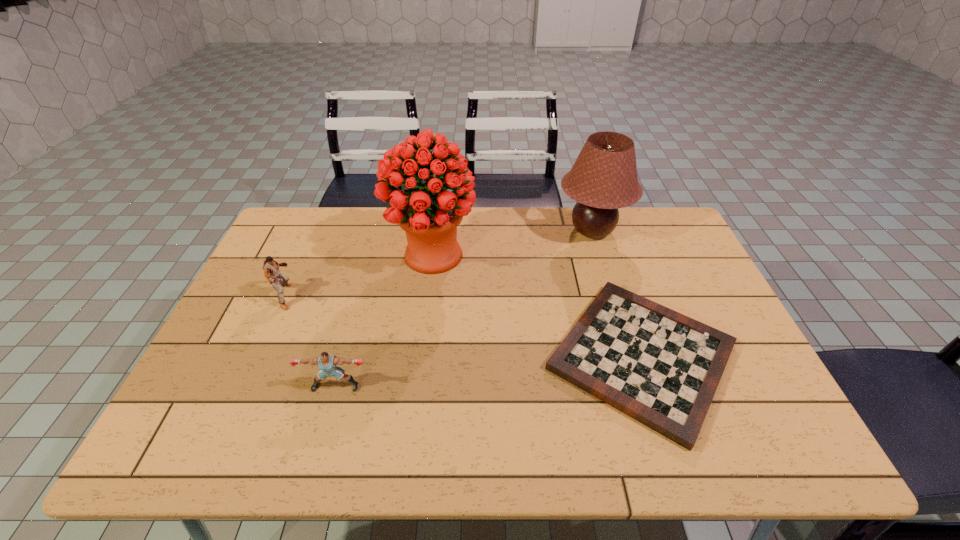
Identify the location of vacant space that is in between the bouquet and the second tallest object. (513, 243).

I want to click on free space between the leftmost object and the nearer puncher, so click(311, 341).

You are a GUI agent. You are given a task and a screenshot of the screen. Output one action in this format:
    pyautogui.click(x=<x>, y=<y>)
    Task: Click on the vacant area between the leftmost object and the fourth tallest object
    
    Given the screenshot: What is the action you would take?
    pyautogui.click(x=311, y=341)

Where is `free space between the farther puncher and the shortest object`? free space between the farther puncher and the shortest object is located at coordinates (464, 327).

The width and height of the screenshot is (960, 540). Identify the location of the third closest object to the bouquet. (604, 178).

Find the location of a particular element. The image size is (960, 540). object that is the third closest to the left puncher is located at coordinates (662, 368).

I want to click on vacant space that satisfies the following two spatial constraints: 1. on the front side of the shortest object; 2. on the right side of the bouquet, so click(420, 356).

At what (x,y) coordinates should I click in order to perform the action: click on vacant space that satisfies the following two spatial constraints: 1. on the front-facing side of the shortest object; 2. on the right side of the lampshade. Please return your answer as a coordinate pair (x, y). The image size is (960, 540). Looking at the image, I should click on (631, 356).

The height and width of the screenshot is (540, 960). Find the location of `blank space that satisfies the following two spatial constraints: 1. on the front-facing side of the lampshade; 2. on the front-facing side of the shorter puncher`. blank space that satisfies the following two spatial constraints: 1. on the front-facing side of the lampshade; 2. on the front-facing side of the shorter puncher is located at coordinates (639, 386).

You are a GUI agent. You are given a task and a screenshot of the screen. Output one action in this format:
    pyautogui.click(x=<x>, y=<y>)
    Task: Click on the free spot that satisfies the following two spatial constraints: 1. on the front-facing side of the lampshade; 2. on the front-facing side of the shorter puncher
    This screenshot has width=960, height=540.
    Given the screenshot: What is the action you would take?
    pyautogui.click(x=639, y=386)